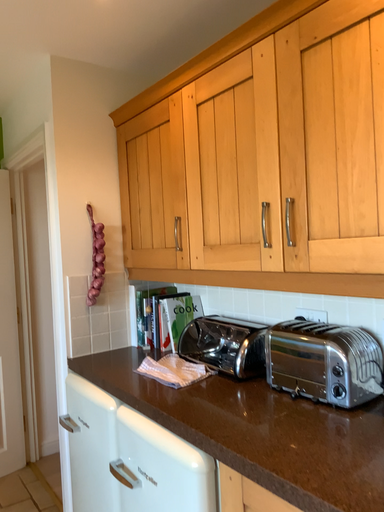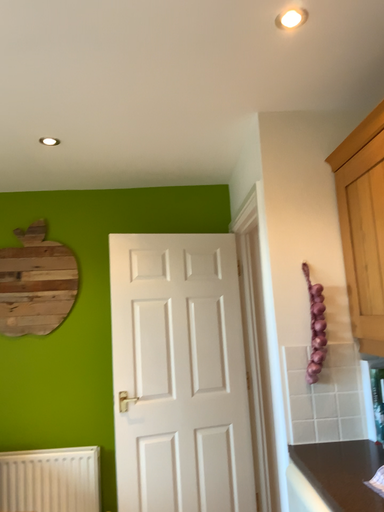
Question: How did the camera likely rotate when shooting the video?

Choices:
 (A) rotated left
 (B) rotated right

Answer: (A)